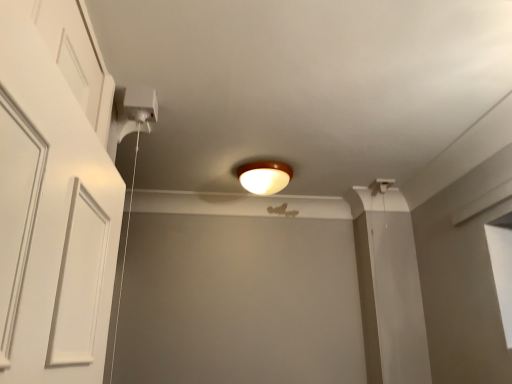
Identify the location of matte brown lampshade at center. (264, 176).

Image resolution: width=512 pixels, height=384 pixels. What do you see at coordinates (264, 176) in the screenshot? I see `matte brown lampshade at center` at bounding box center [264, 176].

The width and height of the screenshot is (512, 384). In order to click on matte brown lampshade at center in this screenshot , I will do `click(264, 176)`.